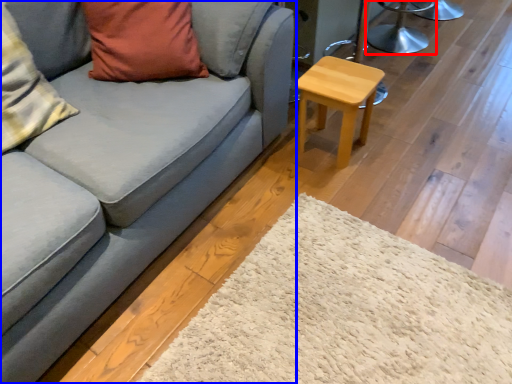
Question: Among these objects, which one is farthest to the camera, swivel chair (highlighted by a red box) or studio couch (highlighted by a blue box)?

Choices:
 (A) swivel chair
 (B) studio couch

Answer: (A)